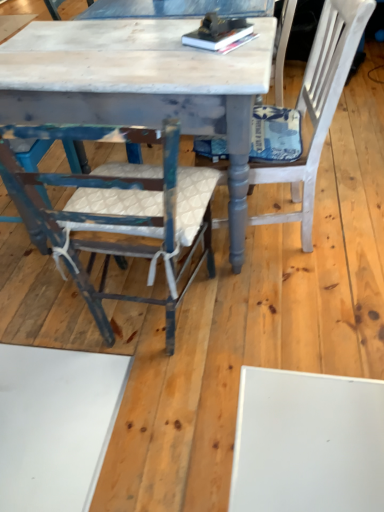
Locate an element on the screen. Image resolution: width=384 pixels, height=512 pixels. free location in front of hardcover books at center is located at coordinates coord(215,64).